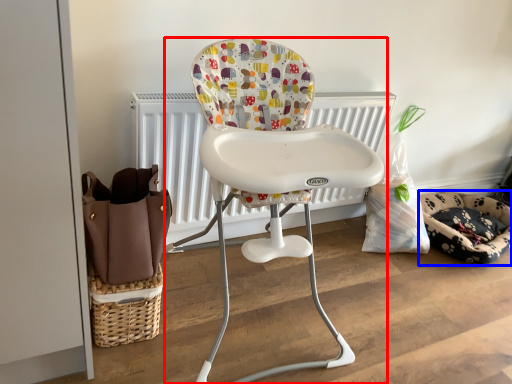
Question: Among these objects, which one is nearest to the camera, chair (highlighted by a red box) or dog bed (highlighted by a blue box)?

Choices:
 (A) chair
 (B) dog bed

Answer: (A)